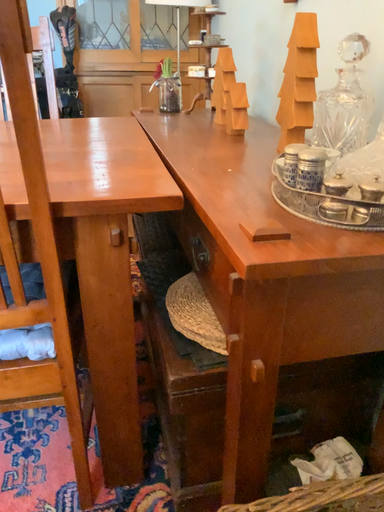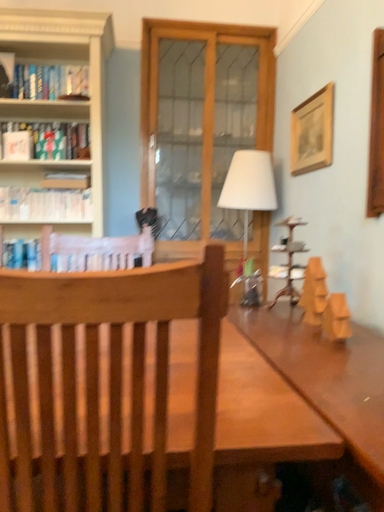
Question: Which way did the camera rotate in the video?

Choices:
 (A) rotated downward
 (B) rotated upward

Answer: (B)